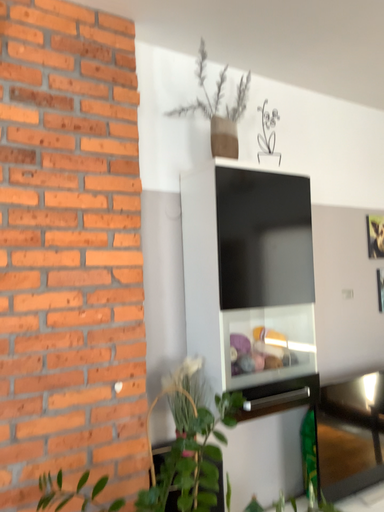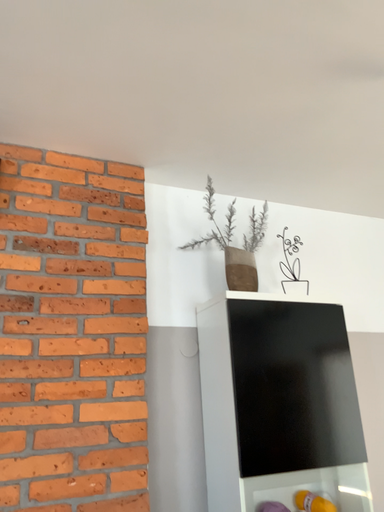
Question: Which way did the camera rotate in the video?

Choices:
 (A) rotated right
 (B) rotated left

Answer: (B)